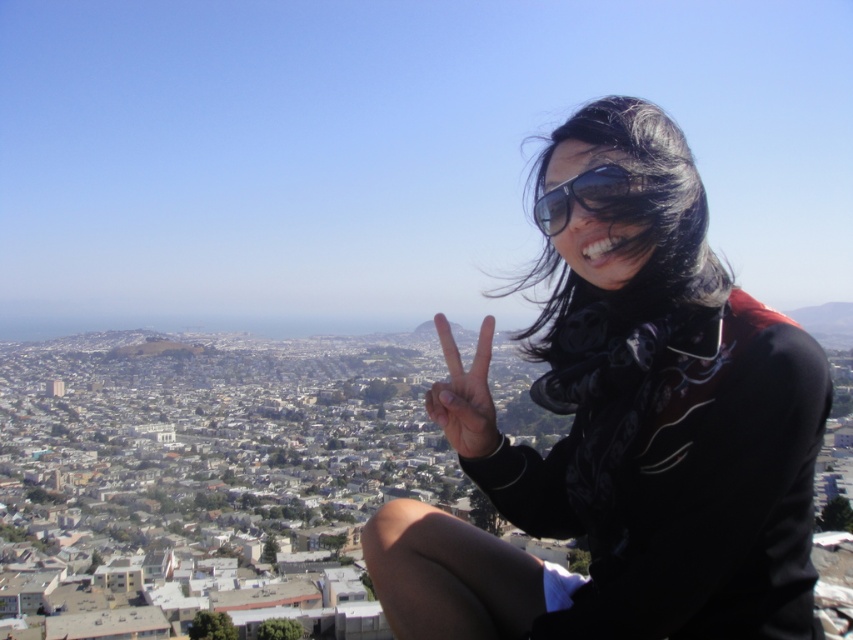
You are a photographer trying to capture the perfect shot of the person on the hilltop. You notice the black matte scarf at right and the sunglasses at upper right. Which object should you focus on if you want to capture the larger one in detail?

Result: The black matte scarf at right is bigger than the sunglasses at upper right, so you should focus on the black matte scarf at right to capture the larger one in detail.

You are a photographer trying to capture the perfect shot of the black matte scarf at right and the sunglasses at upper right. Which object should you focus on first if you want to ensure both are in focus without adjusting the camera settings?

You should focus on the black matte scarf at right first because it is closer to the viewer than the sunglasses at upper right. By focusing on the closer object, the farther one may still be within the depth of field, ensuring both are in focus without needing to adjust the camera settings.